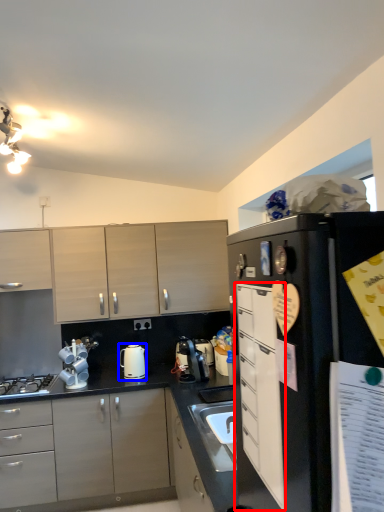
Question: Which object appears closest to the camera in this image, cabinetry (highlighted by a red box) or kitchen appliance (highlighted by a blue box)?

Choices:
 (A) cabinetry
 (B) kitchen appliance

Answer: (A)